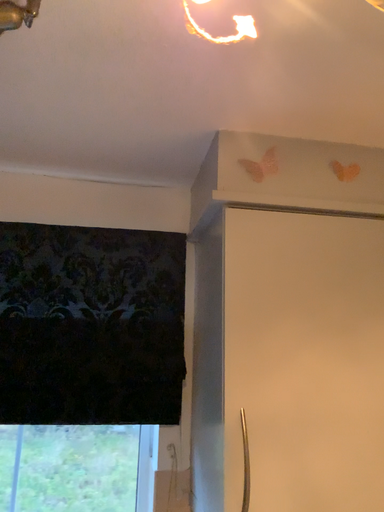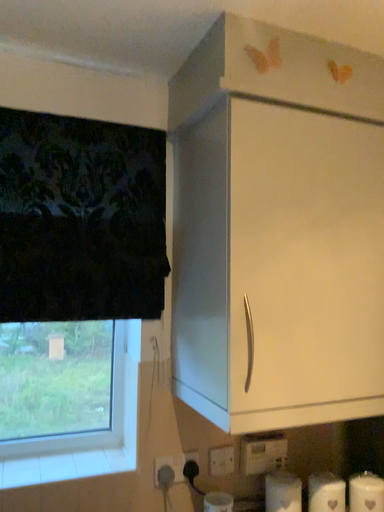
Question: Which way did the camera rotate in the video?

Choices:
 (A) rotated right
 (B) rotated left

Answer: (A)